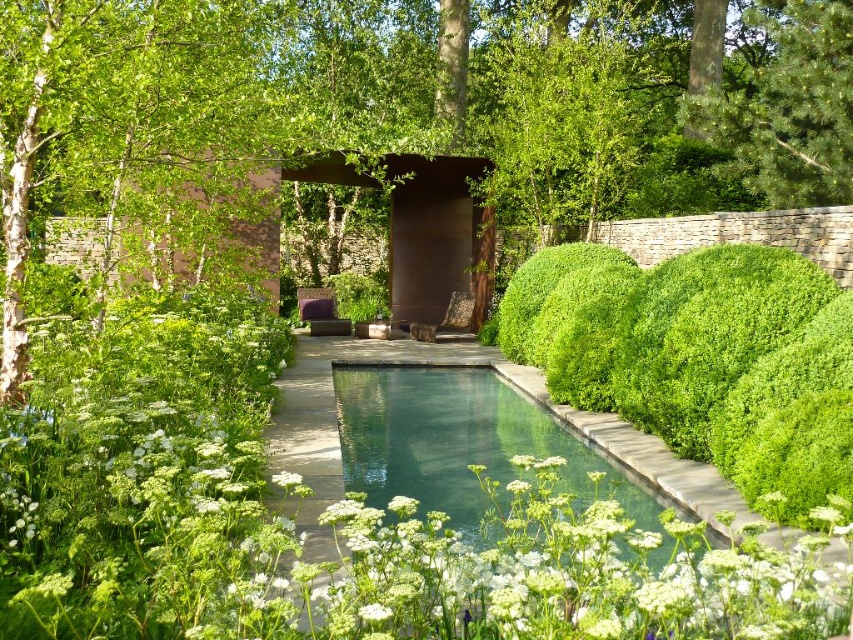
Question: Which point is farther to the camera?

Choices:
 (A) green pine tree at upper right
 (B) green leafy tree at center
 (C) green leafy hedge at right

Answer: (A)

Question: Can you confirm if green leafy tree at center is positioned above clear glass pool at center?

Choices:
 (A) no
 (B) yes

Answer: (B)

Question: Does green leafy tree at center appear over clear glass pool at center?

Choices:
 (A) no
 (B) yes

Answer: (B)

Question: Which point is farther from the camera taking this photo?

Choices:
 (A) (405, 8)
 (B) (804, 362)
 (C) (808, 128)
 (D) (485, 381)

Answer: (A)

Question: Is green leafy tree at center positioned in front of green pine tree at upper right?

Choices:
 (A) yes
 (B) no

Answer: (A)

Question: Estimate the real-world distances between objects in this image. Which object is closer to the clear glass pool at center?

Choices:
 (A) green leafy hedge at right
 (B) green leafy tree at center
 (C) green pine tree at upper right

Answer: (A)